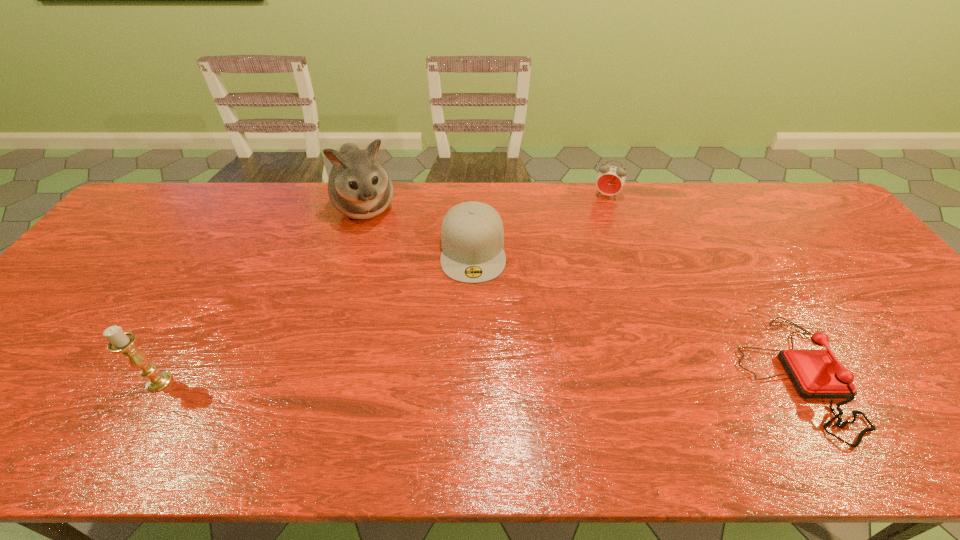
Identify the location of vacant space at the near left corner of the desktop. The image size is (960, 540). (53, 388).

In the image, there is a desktop. Identify the location of vacant space at the near right corner. Image resolution: width=960 pixels, height=540 pixels. (930, 377).

Find the location of `unoccupied position between the fourth object from left to right and the shortest object`. unoccupied position between the fourth object from left to right and the shortest object is located at coordinates (701, 287).

What are the coordinates of `unoccupied position between the shortest object and the hamster` in the screenshot? It's located at (580, 292).

Find the location of a particular element. The width and height of the screenshot is (960, 540). free space between the second shortest object and the tallest object is located at coordinates (420, 228).

Identify the location of empty space between the rightmost object and the third object from right to left. This screenshot has height=540, width=960. (634, 313).

I want to click on free space between the fourth object from right to left and the fourth shortest object, so click(x=262, y=295).

You are a GUI agent. You are given a task and a screenshot of the screen. Output one action in this format:
    pyautogui.click(x=<x>, y=<y>)
    Task: Click on the vacant region between the second tallest object and the hamster
    
    Given the screenshot: What is the action you would take?
    pyautogui.click(x=262, y=295)

The width and height of the screenshot is (960, 540). What are the coordinates of `free space that is in between the shortest object and the candle holder` in the screenshot? It's located at (476, 380).

What are the coordinates of `blank region between the third shortest object and the hamster` in the screenshot? It's located at (487, 201).